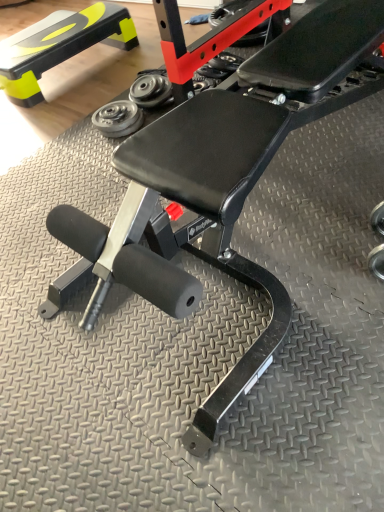
Locate an element on the screen. The height and width of the screenshot is (512, 384). metallic silver weight at center, which appears as the 2th dumbbell when ordered from the bottom is located at coordinates (150, 90).

What are the coordinates of `matte black step at upper left` in the screenshot? It's located at (59, 46).

Is matte black step at upper left located within metallic silver weight at center, acting as the 1th dumbbell starting from the top?

Definitely not — matte black step at upper left is not inside metallic silver weight at center, acting as the 1th dumbbell starting from the top.

Can you confirm if metallic silver weight at center, which appears as the 2th dumbbell when ordered from the bottom, is wider than matte black step at upper left?

In fact, metallic silver weight at center, which appears as the 2th dumbbell when ordered from the bottom, might be narrower than matte black step at upper left.

From a real-world perspective, which is physically below, metallic silver weight at center, which appears as the 2th dumbbell when ordered from the bottom, or matte black step at upper left?

metallic silver weight at center, which appears as the 2th dumbbell when ordered from the bottom.

From the image's perspective, who appears lower, metallic silver weight at center, acting as the 1th dumbbell starting from the top, or matte black step at upper left?

metallic silver weight at center, acting as the 1th dumbbell starting from the top.

Considering the positions of objects matte black step at upper left and metallic silver weight at center, which appears as the 2th dumbbell when ordered from the bottom, in the image provided, who is in front, matte black step at upper left or metallic silver weight at center, which appears as the 2th dumbbell when ordered from the bottom,?

metallic silver weight at center, which appears as the 2th dumbbell when ordered from the bottom, is closer to the camera.

Is matte black step at upper left to the left of metallic silver weight at center, acting as the 1th dumbbell starting from the top, from the viewer's perspective?

Yes.

This screenshot has width=384, height=512. I want to click on bench to the left of metallic silver weight at center, acting as the 1th dumbbell starting from the top, so click(x=59, y=46).

Is silver metallic dumbbell at center, which appears as the first dumbbell when ordered from the bottom, further to the viewer compared to metallic silver weight at center, which appears as the 2th dumbbell when ordered from the bottom?

No, it is in front of metallic silver weight at center, which appears as the 2th dumbbell when ordered from the bottom.

The width and height of the screenshot is (384, 512). Find the location of `dumbbell behind the silver metallic dumbbell at center, which appears as the second dumbbell when viewed from the top`. dumbbell behind the silver metallic dumbbell at center, which appears as the second dumbbell when viewed from the top is located at coordinates (150, 90).

From a real-world perspective, is metallic silver weight at center, acting as the 1th dumbbell starting from the top, on silver metallic dumbbell at center, which appears as the first dumbbell when ordered from the bottom?

Yes, from a real-world perspective, metallic silver weight at center, acting as the 1th dumbbell starting from the top, is above silver metallic dumbbell at center, which appears as the first dumbbell when ordered from the bottom.

Which object is further away from the camera, metallic silver weight at center, acting as the 1th dumbbell starting from the top, or silver metallic dumbbell at center, which appears as the second dumbbell when viewed from the top?

metallic silver weight at center, acting as the 1th dumbbell starting from the top, is further away from the camera.

Can you confirm if metallic silver weight at center, which appears as the 2th dumbbell when ordered from the bottom, is bigger than silver metallic dumbbell at center, which appears as the second dumbbell when viewed from the top?

No.

In the scene shown: Is metallic silver weight at center, which appears as the 2th dumbbell when ordered from the bottom, looking in the opposite direction of silver metallic dumbbell at center, which appears as the second dumbbell when viewed from the top?

No, metallic silver weight at center, which appears as the 2th dumbbell when ordered from the bottom, is not facing the opposite direction of silver metallic dumbbell at center, which appears as the second dumbbell when viewed from the top.

From the image's perspective, which one is positioned higher, matte black step at upper left or silver metallic dumbbell at center, which appears as the first dumbbell when ordered from the bottom?

matte black step at upper left is shown above in the image.

Which is correct: matte black step at upper left is inside silver metallic dumbbell at center, which appears as the second dumbbell when viewed from the top, or outside of it?

matte black step at upper left is not enclosed by silver metallic dumbbell at center, which appears as the second dumbbell when viewed from the top.

Considering the sizes of objects matte black step at upper left and silver metallic dumbbell at center, which appears as the first dumbbell when ordered from the bottom, in the image provided, who is thinner, matte black step at upper left or silver metallic dumbbell at center, which appears as the first dumbbell when ordered from the bottom,?

Thinner between the two is silver metallic dumbbell at center, which appears as the first dumbbell when ordered from the bottom.

Is silver metallic dumbbell at center, which appears as the first dumbbell when ordered from the bottom, bigger or smaller than matte black step at upper left?

Considering their sizes, silver metallic dumbbell at center, which appears as the first dumbbell when ordered from the bottom, takes up less space than matte black step at upper left.

Is silver metallic dumbbell at center, which appears as the second dumbbell when viewed from the top, far away from matte black step at upper left?

silver metallic dumbbell at center, which appears as the second dumbbell when viewed from the top, is near matte black step at upper left, not far away.

Is point (103, 132) positioned in front of point (63, 60)?

Yes, it is.

Who is shorter, silver metallic dumbbell at center, which appears as the first dumbbell when ordered from the bottom, or matte black step at upper left?

silver metallic dumbbell at center, which appears as the first dumbbell when ordered from the bottom, is shorter.

Locate an element on the screen. bench above the metallic silver weight at center, acting as the 1th dumbbell starting from the top (from the image's perspective) is located at coordinates (59, 46).

Starting from the matte black step at upper left, which dumbbell is the 2nd one to the right? Please provide its 2D coordinates.

[(150, 90)]

Which object lies further to the anchor point metallic silver weight at center, acting as the 1th dumbbell starting from the top, silver metallic dumbbell at center, which appears as the first dumbbell when ordered from the bottom, or matte black step at upper left?

matte black step at upper left is positioned further to the anchor metallic silver weight at center, acting as the 1th dumbbell starting from the top.

Looking at the image, which one is located closer to matte black step at upper left, metallic silver weight at center, acting as the 1th dumbbell starting from the top, or silver metallic dumbbell at center, which appears as the first dumbbell when ordered from the bottom?

metallic silver weight at center, acting as the 1th dumbbell starting from the top, lies closer to matte black step at upper left than the other object.

Which object lies nearer to the anchor point silver metallic dumbbell at center, which appears as the first dumbbell when ordered from the bottom, matte black step at upper left or metallic silver weight at center, which appears as the 2th dumbbell when ordered from the bottom?

Among the two, metallic silver weight at center, which appears as the 2th dumbbell when ordered from the bottom, is located nearer to silver metallic dumbbell at center, which appears as the first dumbbell when ordered from the bottom.

Looking at the image, which one is located closer to matte black step at upper left, silver metallic dumbbell at center, which appears as the second dumbbell when viewed from the top, or metallic silver weight at center, acting as the 1th dumbbell starting from the top?

Based on the image, metallic silver weight at center, acting as the 1th dumbbell starting from the top, appears to be nearer to matte black step at upper left.

Which object lies nearer to the anchor point metallic silver weight at center, which appears as the 2th dumbbell when ordered from the bottom, matte black step at upper left or silver metallic dumbbell at center, which appears as the second dumbbell when viewed from the top?

The object closer to metallic silver weight at center, which appears as the 2th dumbbell when ordered from the bottom, is silver metallic dumbbell at center, which appears as the second dumbbell when viewed from the top.

When comparing their distances from silver metallic dumbbell at center, which appears as the first dumbbell when ordered from the bottom, does metallic silver weight at center, which appears as the 2th dumbbell when ordered from the bottom, or matte black step at upper left seem closer?

The object closer to silver metallic dumbbell at center, which appears as the first dumbbell when ordered from the bottom, is metallic silver weight at center, which appears as the 2th dumbbell when ordered from the bottom.

Identify the location of dumbbell between matte black step at upper left and metallic silver weight at center, which appears as the 2th dumbbell when ordered from the bottom, in the horizontal direction. (118, 118).